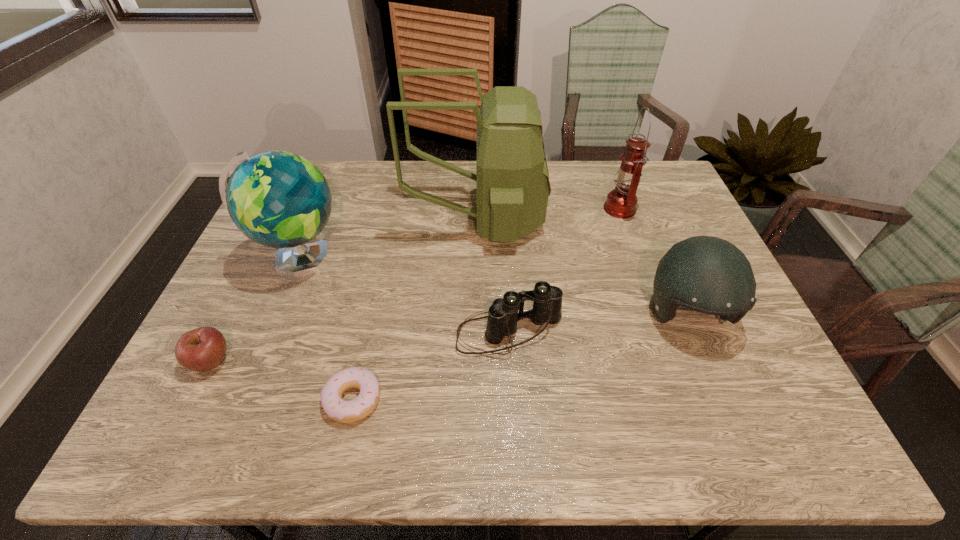
Find the location of a particular element. This screenshot has height=540, width=960. the tallest object is located at coordinates (512, 179).

Find the location of `oil lamp`. oil lamp is located at coordinates (621, 202).

Identify the location of globe. (279, 199).

At what (x,y) coordinates should I click in order to perform the action: click on the fourth shortest object. Please return your answer as a coordinate pair (x, y). Image resolution: width=960 pixels, height=540 pixels. Looking at the image, I should click on (707, 274).

Find the location of a particular element. This screenshot has width=960, height=540. binoculars is located at coordinates (503, 315).

You are a GUI agent. You are given a task and a screenshot of the screen. Output one action in this format:
    pyautogui.click(x=<x>, y=<y>)
    Task: Click on the apple
    Image resolution: width=960 pixels, height=540 pixels.
    Given the screenshot: What is the action you would take?
    [202, 349]

In order to click on doughnut in this screenshot , I will do `click(336, 408)`.

This screenshot has height=540, width=960. Identify the location of free location located 0.090m on the front pocket of the backpack. (573, 220).

The width and height of the screenshot is (960, 540). In order to click on vacant space located on the left of the oil lamp in this screenshot , I will do `click(555, 208)`.

Locate an element on the screen. The width and height of the screenshot is (960, 540). free region located 0.280m on the front surface of the globe is located at coordinates (448, 259).